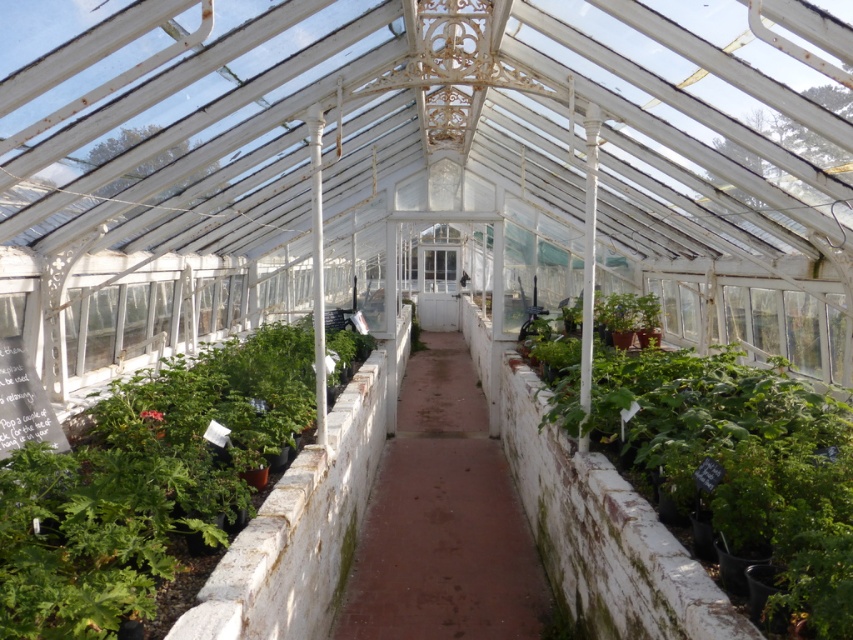
Question: Can you confirm if green leafy plant at left is positioned to the left of green leafy plant at right?

Choices:
 (A) no
 (B) yes

Answer: (B)

Question: Is green leafy plant at left bigger than green leafy plant at right?

Choices:
 (A) yes
 (B) no

Answer: (B)

Question: Which point is farther from the camera taking this photo?

Choices:
 (A) (193, 456)
 (B) (662, 368)

Answer: (B)

Question: Which point is closer to the camera?

Choices:
 (A) (822, 608)
 (B) (56, 460)

Answer: (A)

Question: Which of the following is the closest to the observer?

Choices:
 (A) (831, 552)
 (B) (59, 618)

Answer: (B)

Question: Considering the relative positions of green leafy plant at left and green leafy plant at right in the image provided, where is green leafy plant at left located with respect to green leafy plant at right?

Choices:
 (A) above
 (B) below

Answer: (B)